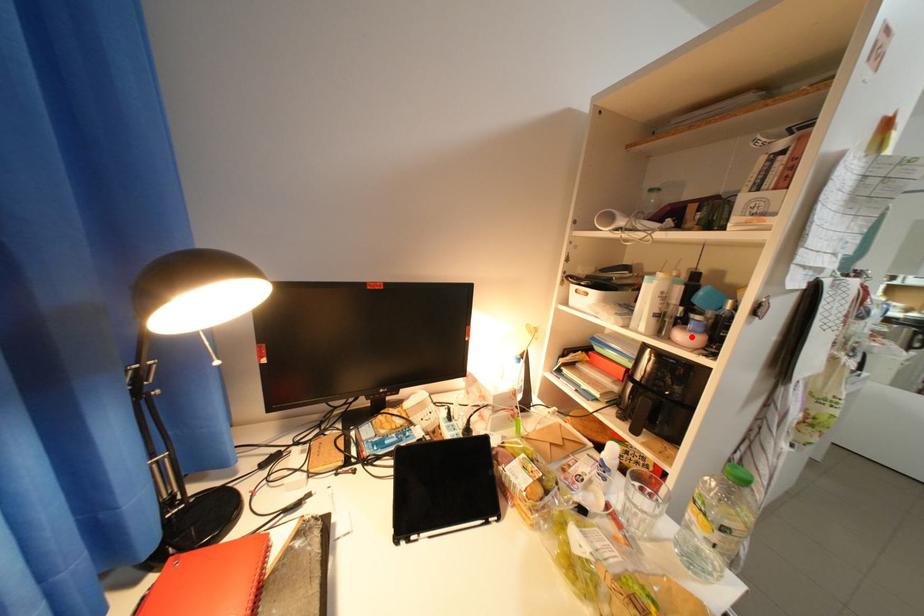
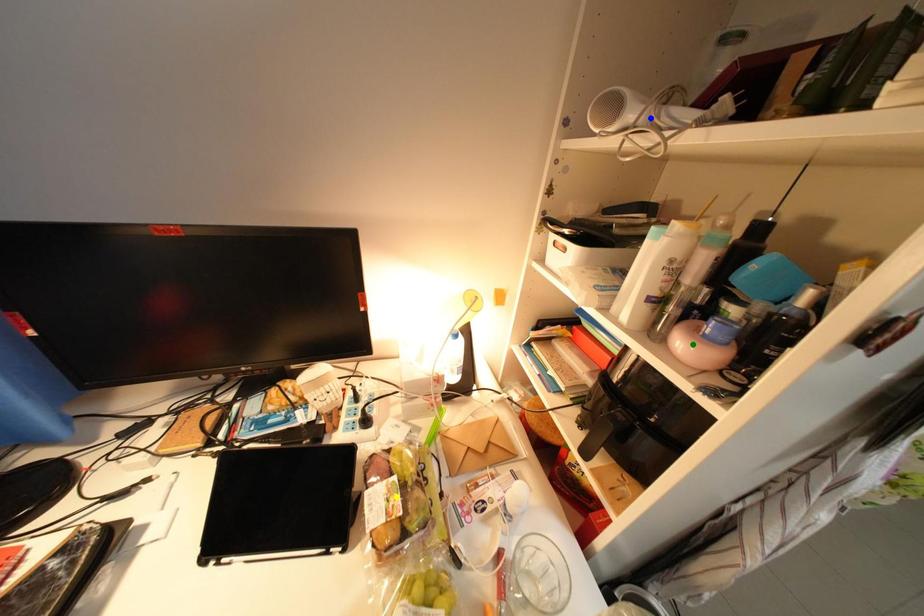
Question: I am providing you with two images of the same scene from different viewpoints. A red point is marked on the first image. You are given multiple points on the second image. Which point in image 2 represents the same 3d spot as the red point in image 1?

Choices:
 (A) blue point
 (B) yellow point
 (C) green point

Answer: (C)